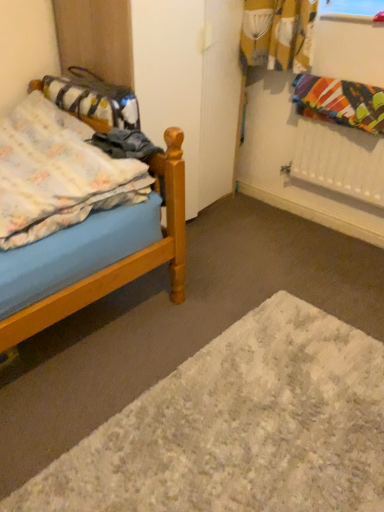
At what (x,y) coordinates should I click in order to perform the action: click on vacant region above white shaggy rug at lower center (from a real-world perspective). Please return your answer as a coordinate pair (x, y). Looking at the image, I should click on (256, 408).